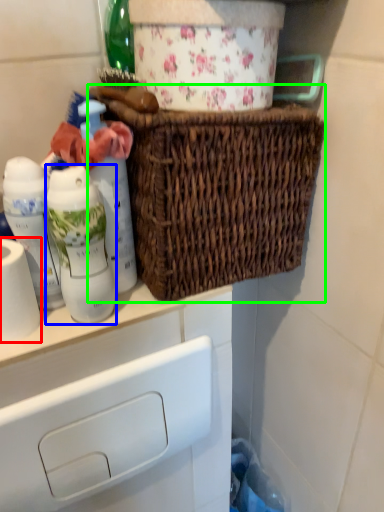
Question: Which object is the closest to the toilet paper (highlighted by a red box)? Choose among these: bottle (highlighted by a blue box) or picnic basket (highlighted by a green box).

Choices:
 (A) bottle
 (B) picnic basket

Answer: (A)